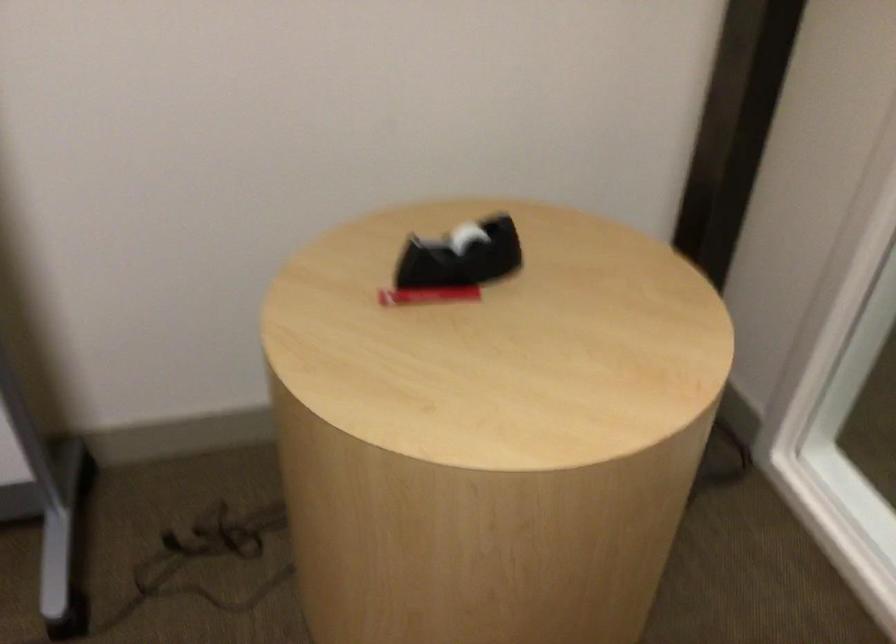
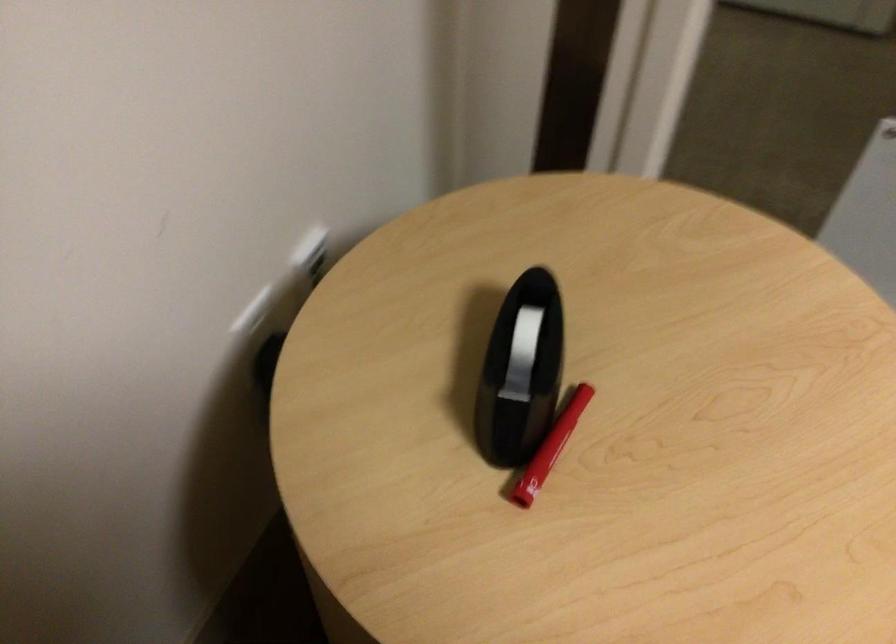
Locate, in the second image, the point that corresponds to (x=444, y=242) in the first image.

(521, 354)